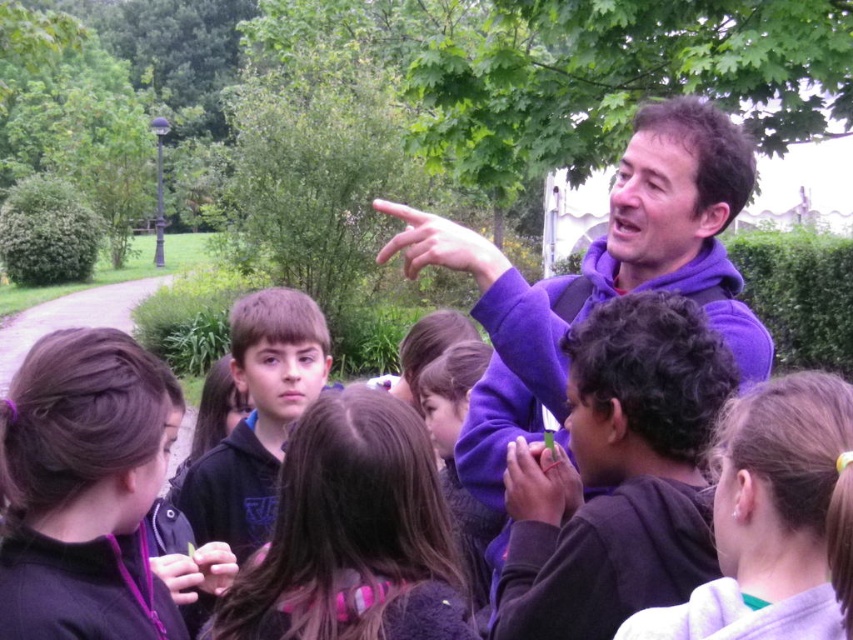
Can you confirm if purple fleece jacket at center is positioned below matte purple sweater at center?

Actually, purple fleece jacket at center is above matte purple sweater at center.

Is purple fleece jacket at center closer to camera compared to matte purple sweater at center?

That is True.

This screenshot has height=640, width=853. In order to click on purple fleece jacket at center in this screenshot , I will do `click(599, 275)`.

Which is more to the left, purple fleece jacket at center or matte skin hand at lower center?

From the viewer's perspective, matte skin hand at lower center appears more on the left side.

Describe the element at coordinates (599, 275) in the screenshot. The image size is (853, 640). I see `purple fleece jacket at center` at that location.

The image size is (853, 640). I want to click on purple fleece jacket at center, so click(599, 275).

Can you confirm if brown hair at center is taller than matte purple sweater at upper center?

Correct, brown hair at center is much taller as matte purple sweater at upper center.

Is brown hair at center thinner than matte purple sweater at upper center?

No, brown hair at center is not thinner than matte purple sweater at upper center.

Where is `brown hair at center`? The image size is (853, 640). brown hair at center is located at coordinates (352, 534).

Identify the location of brown hair at center. This screenshot has height=640, width=853. (352, 534).